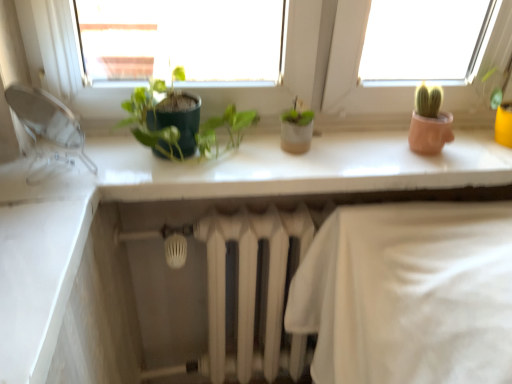
This screenshot has width=512, height=384. Identify the location of vacant space underneath green matte plant at center (from a real-world perspective). (192, 157).